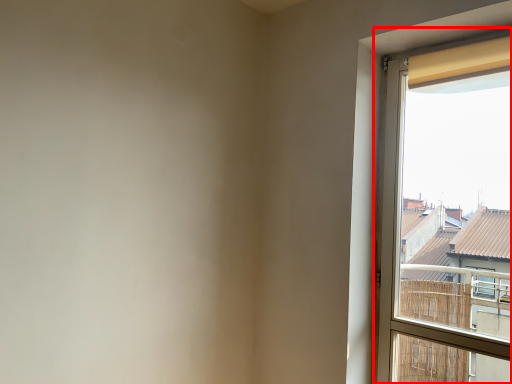
Question: From the image's perspective, where is window (annotated by the red box) located relative to curtain?

Choices:
 (A) below
 (B) above

Answer: (A)